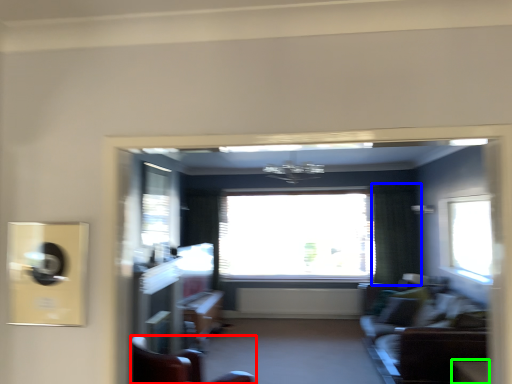
Question: Based on their relative distances, which object is farther from furniture (highlighted by a red box)? Choose from curtain (highlighted by a blue box) and table (highlighted by a green box).

Choices:
 (A) curtain
 (B) table

Answer: (A)